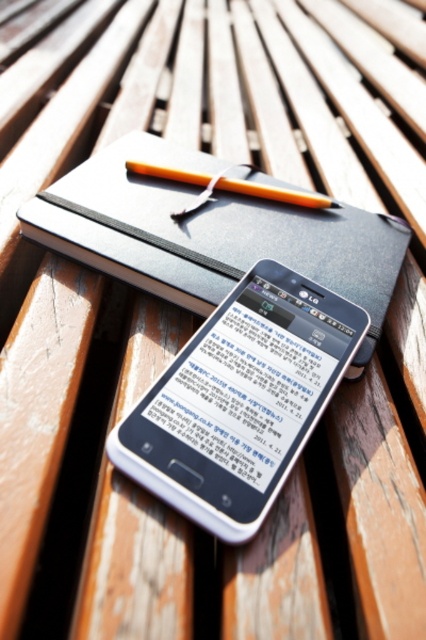
Is point (301, 298) closer to viewer compared to point (221, 179)?

Yes, point (301, 298) is in front of point (221, 179).

Can you confirm if white glossy smartphone at center is shorter than orange wood pen at center?

No, white glossy smartphone at center is not shorter than orange wood pen at center.

The width and height of the screenshot is (426, 640). What do you see at coordinates (241, 401) in the screenshot? I see `white glossy smartphone at center` at bounding box center [241, 401].

You are a GUI agent. You are given a task and a screenshot of the screen. Output one action in this format:
    pyautogui.click(x=<x>, y=<y>)
    Task: Click on the white glossy smartphone at center
    This screenshot has height=640, width=426.
    Given the screenshot: What is the action you would take?
    pyautogui.click(x=241, y=401)